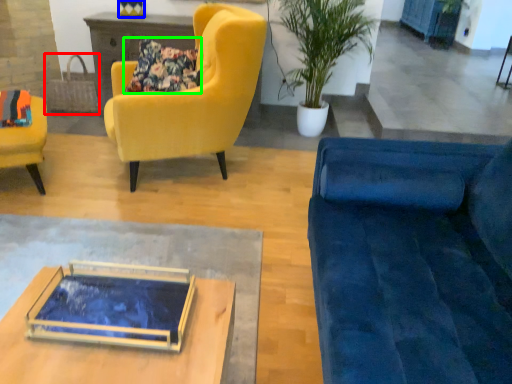
Question: Which object is positioned closest to handbag (highlighted by a red box)? Select from vase (highlighted by a blue box) and pillow (highlighted by a green box).

Choices:
 (A) vase
 (B) pillow

Answer: (A)